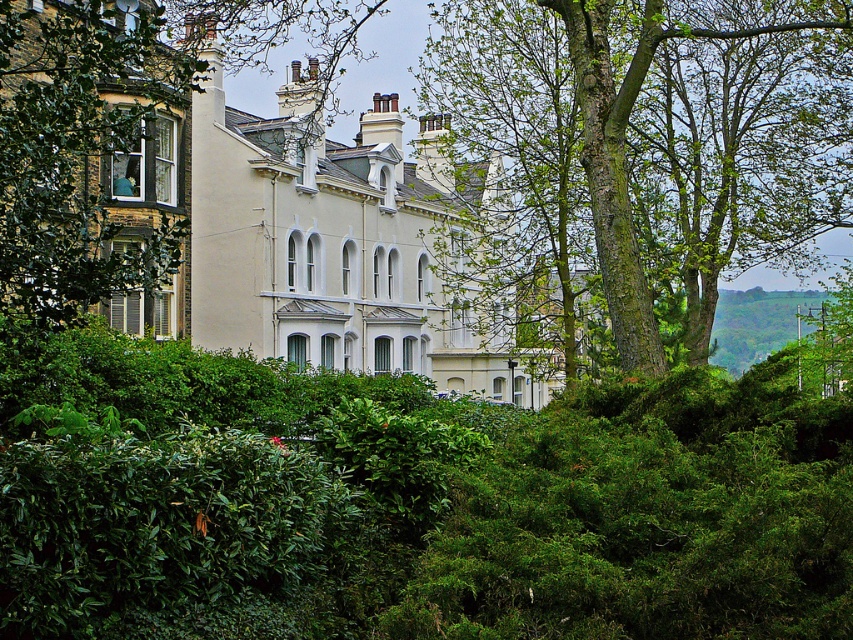
You are standing in the garden of the beige stone mansion at center and want to take a photo of the green bark tree at center. Which direction should you face to ensure the tree is in the background of your photo?

You should face away from the green bark tree at center towards the beige stone mansion at center. Since the green bark tree at center is closer to you than the beige stone mansion at center, positioning yourself with the mansion in front will place the tree behind it in the photo.

You are standing in front of the beige stone mansion at center and want to walk towards the green bark tree at center. Which direction should you move to reach it?

The green bark tree at center is to the right of the beige stone mansion at center, so you should move to your right to reach it.

Based on the photo, you are standing in front of the Victorian houses and notice a green bark tree at center. Can you confirm if the point marked at coordinates (524,179) corresponds to the location of the green bark tree at center?

Yes, the point marked at coordinates (524,179) corresponds to the green bark tree at center as stated in the objects description.